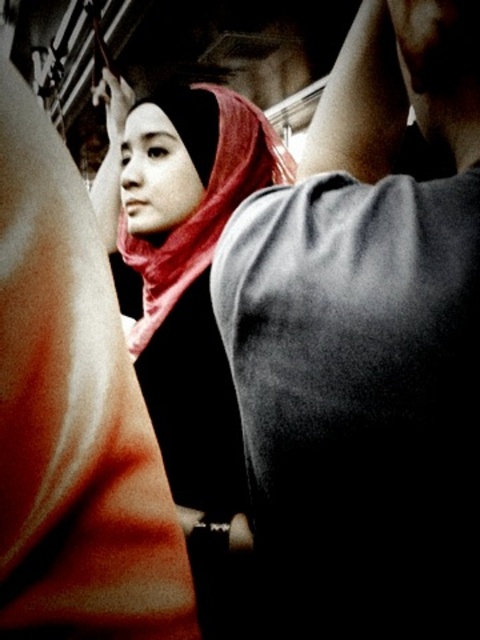
You are a designer creating a layout for a magazine spread. You need to place two elements based on their widths. The elements are the gray matte shirt at upper right and the matte red scarf at center. Which element should you place first if you want to arrange them from narrowest to widest?

The gray matte shirt at upper right has a lesser width compared to the matte red scarf at center, so you should place the gray matte shirt at upper right first, followed by the matte red scarf at center.

You are a passenger on a moving train and want to know the exact location of the gray matte shirt at upper right. Can you tell me its coordinates?

The gray matte shirt at upper right is located at point (367, 342).

You are standing in a moving train holding a map and need to reach a point that is exactly 20 inches away from you. Is the point at coordinates point (334,460) within your reach?

The point (334,460) is 21.51 inches from the viewer, which is slightly beyond the 20 inches reach, so it is out of reach.